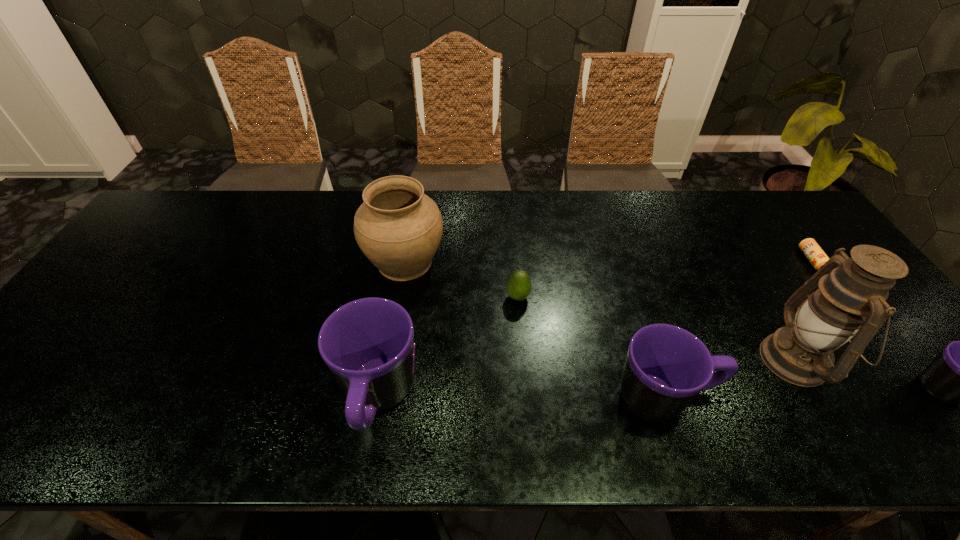
Find the location of `vacant space situated 0.170m on the front of the third object from left to right`. vacant space situated 0.170m on the front of the third object from left to right is located at coordinates (523, 360).

This screenshot has width=960, height=540. I want to click on vacant space located 0.200m on the left of the urn, so click(x=296, y=262).

The height and width of the screenshot is (540, 960). I want to click on vacant space located 0.090m on the right of the third object from right to left, so click(x=868, y=360).

This screenshot has height=540, width=960. Find the location of `object that is at the far edge`. object that is at the far edge is located at coordinates (398, 228).

Locate an element on the screen. oil lamp at the near edge is located at coordinates (851, 300).

I want to click on object at the right edge, so click(817, 257).

This screenshot has width=960, height=540. Find the location of `free location at the far edge of the desktop`. free location at the far edge of the desktop is located at coordinates (496, 222).

Find the location of a particular element. Image resolution: width=960 pixels, height=540 pixels. free space at the near edge is located at coordinates (853, 400).

Locate an element on the screen. Image resolution: width=960 pixels, height=540 pixels. vacant region at the left edge is located at coordinates (159, 246).

The height and width of the screenshot is (540, 960). I want to click on vacant position at the right edge of the desktop, so click(904, 343).